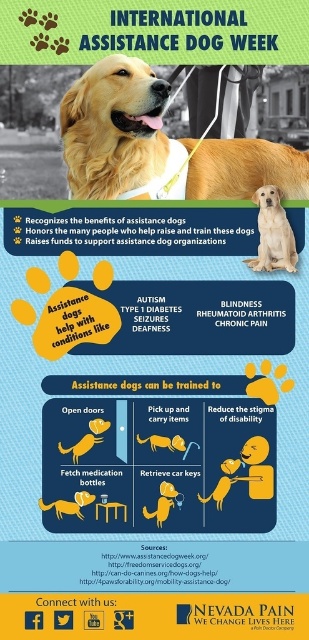
Question: From the image, what is the correct spatial relationship of golden matte fur at center in relation to yellow matte dog at center?

Choices:
 (A) above
 (B) below

Answer: (A)

Question: Which point is closer to the camera?

Choices:
 (A) golden matte fur at center
 (B) yellow matte dog at center
 (C) matte yellow dog at center

Answer: (C)

Question: From the image, what is the correct spatial relationship of golden fur assistance dog at center in relation to matte yellow dog at center?

Choices:
 (A) above
 (B) below

Answer: (A)

Question: Is golden matte fur at center to the left of matte yellow dog at center from the viewer's perspective?

Choices:
 (A) no
 (B) yes

Answer: (A)

Question: Which object appears farthest from the camera in this image?

Choices:
 (A) golden fur assistance dog at center
 (B) matte yellow dog at center
 (C) golden matte fur at center
 (D) yellow matte dog at center

Answer: (A)

Question: Which object appears farthest from the camera in this image?

Choices:
 (A) golden fur assistance dog at center
 (B) golden matte fur at center
 (C) matte yellow dog at center

Answer: (A)